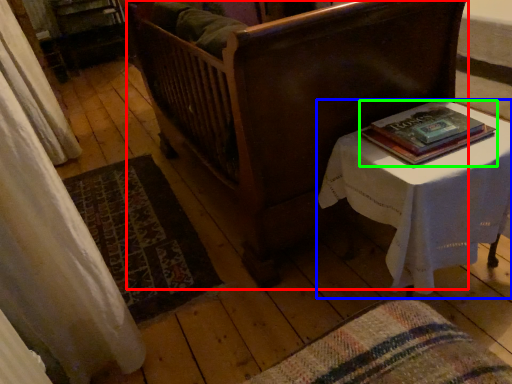
Question: Which object is the closest to the furniture (highlighted by a red box)? Choose among these: table (highlighted by a blue box) or book (highlighted by a green box).

Choices:
 (A) table
 (B) book

Answer: (A)